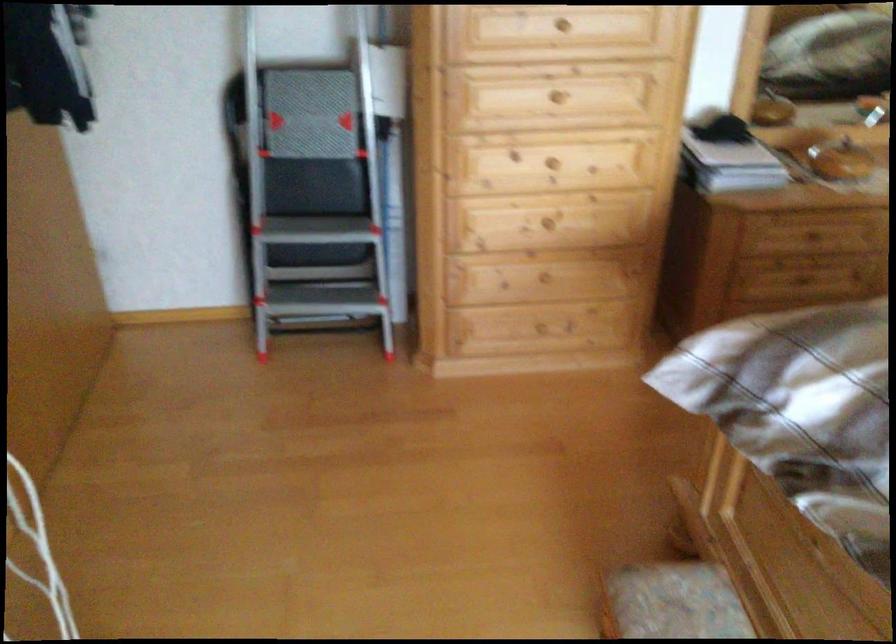
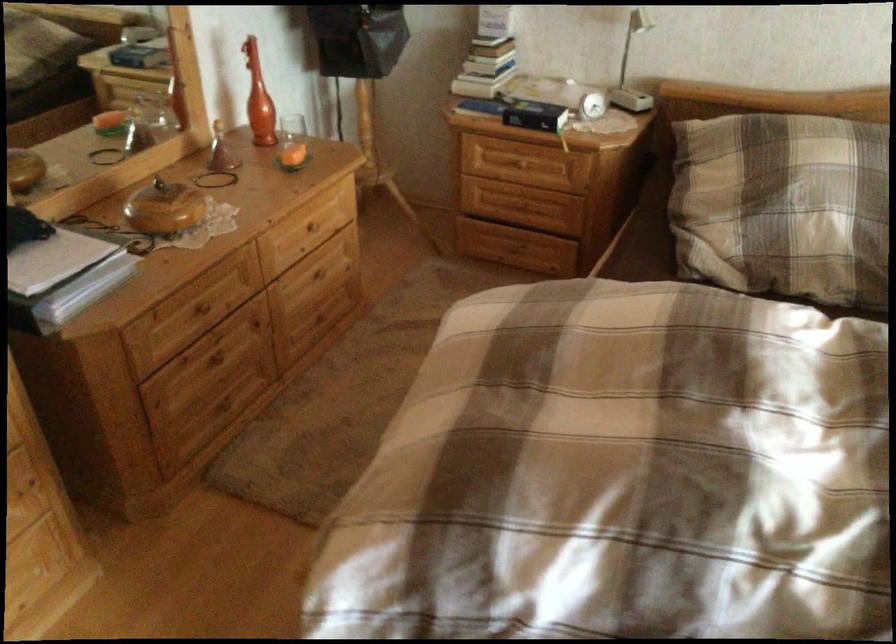
In the second image, find the point that corresponds to [800,272] in the first image.

(218, 362)